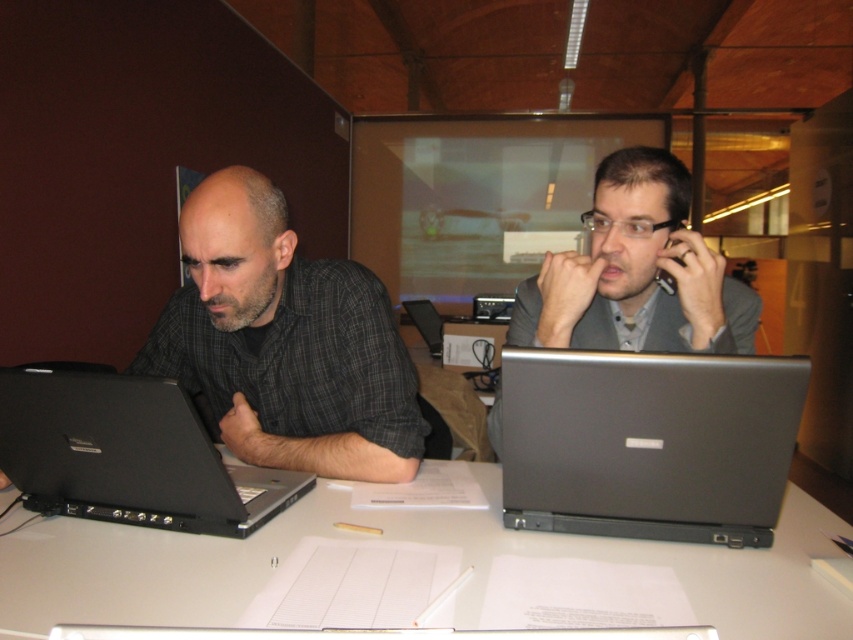
Can you confirm if silver metallic laptop at right is positioned above matte gray suit at right?

No, silver metallic laptop at right is not above matte gray suit at right.

Locate an element on the screen. This screenshot has width=853, height=640. silver metallic laptop at right is located at coordinates (648, 444).

At what (x,y) coordinates should I click in order to perform the action: click on silver metallic laptop at right. Please return your answer as a coordinate pair (x, y). The image size is (853, 640). Looking at the image, I should click on (648, 444).

Is point (206, 573) closer to viewer compared to point (235, 454)?

Yes, it is in front of point (235, 454).

The width and height of the screenshot is (853, 640). What are the coordinates of `white plastic table at center` in the screenshot? It's located at (397, 540).

Between matte black shirt at left and matte gray suit at right, which one is positioned lower?

matte black shirt at left

Who is positioned more to the left, matte black shirt at left or matte gray suit at right?

Positioned to the left is matte black shirt at left.

Does point (173, 310) lie behind point (683, 326)?

Yes.

Identify the location of matte black shirt at left. The image size is (853, 640). (285, 342).